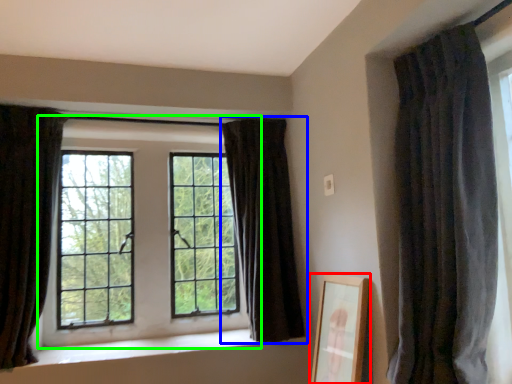
Question: Which is farther away from picture frame (highlighted by a red box)? curtain (highlighted by a blue box) or window (highlighted by a green box)?

Choices:
 (A) curtain
 (B) window

Answer: (B)